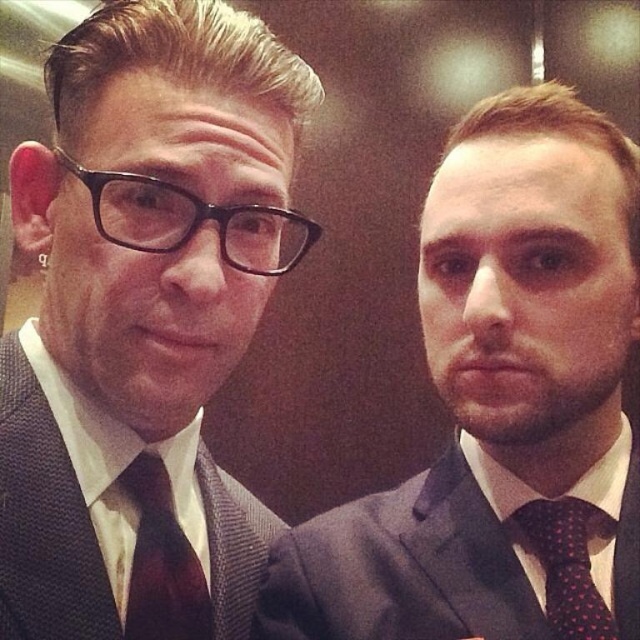
Is matte black suit at center above matte black suit at right?

Yes.

Describe the element at coordinates (145, 321) in the screenshot. I see `matte black suit at center` at that location.

This screenshot has width=640, height=640. Find the location of `matte black suit at center`. matte black suit at center is located at coordinates (145, 321).

Is matte black suit at right to the left of polka dot silk tie at right from the viewer's perspective?

Correct, you'll find matte black suit at right to the left of polka dot silk tie at right.

Between point (397, 580) and point (589, 605), which one is positioned behind?

Positioned behind is point (397, 580).

Locate an element on the screen. matte black suit at right is located at coordinates (502, 404).

Does matte black suit at right have a lesser height compared to dark brown textured suit at left?

No.

The image size is (640, 640). In order to click on matte black suit at right in this screenshot , I will do `click(502, 404)`.

The height and width of the screenshot is (640, 640). Find the location of `matte black suit at right`. matte black suit at right is located at coordinates (502, 404).